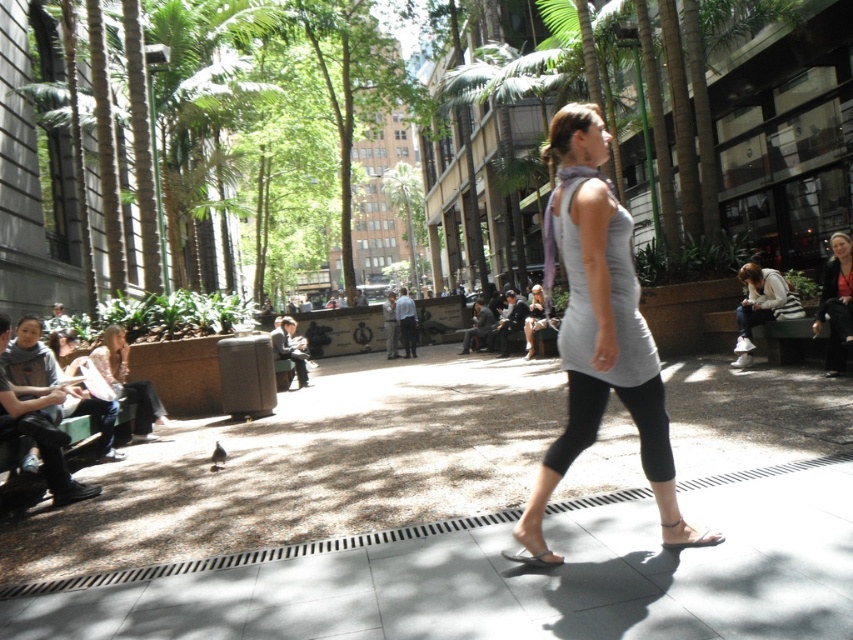
Question: Which is farther from the denim jeans at left?

Choices:
 (A) white leather sandal at lower center
 (B) smooth concrete pavement at center
 (C) green wooden bench at lower left
 (D) light gray fabric jacket at center

Answer: (D)

Question: Which of the following is the farthest from the observer?

Choices:
 (A) dark gray fabric jacket at center
 (B) light gray fabric dress at center
 (C) white fabric jacket at right

Answer: (A)

Question: Does black leather jacket at upper right appear on the right side of light gray fabric jacket at center?

Choices:
 (A) no
 (B) yes

Answer: (B)

Question: Is denim jeans at left wider than green wooden bench at lower left?

Choices:
 (A) yes
 (B) no

Answer: (A)

Question: Can you confirm if black leather jacket at upper right is bigger than light gray fabric jacket at center?

Choices:
 (A) no
 (B) yes

Answer: (A)

Question: Which point is closer to the camera taking this photo?

Choices:
 (A) (73, 410)
 (B) (675, 524)
 (C) (746, 323)
 (D) (90, 355)

Answer: (B)